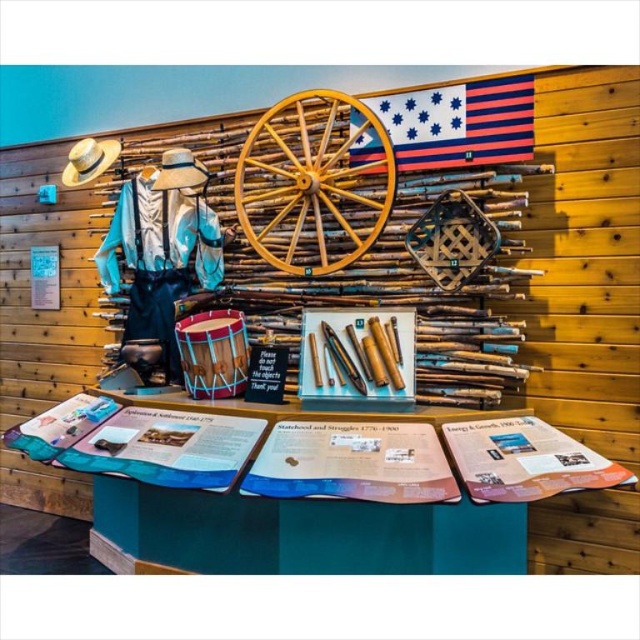
Which is above, blue denim jacket at left or striped fabric flag at upper center?

striped fabric flag at upper center is higher up.

This screenshot has width=640, height=640. What do you see at coordinates (161, 257) in the screenshot?
I see `blue denim jacket at left` at bounding box center [161, 257].

Does point (172, 182) lie behind point (403, 100)?

Yes, it is.

You are a GUI agent. You are given a task and a screenshot of the screen. Output one action in this format:
    pyautogui.click(x=<x>, y=<y>)
    Task: Click on the blue denim jacket at left
    This screenshot has height=640, width=640.
    Given the screenshot: What is the action you would take?
    pyautogui.click(x=161, y=257)

Does wooden wagon wheel at center appear on the left side of blue denim jacket at left?

No, wooden wagon wheel at center is not to the left of blue denim jacket at left.

You are a GUI agent. You are given a task and a screenshot of the screen. Output one action in this format:
    pyautogui.click(x=<x>, y=<y>)
    Task: Click on the wooden wagon wheel at center
    Image resolution: width=640 pixels, height=640 pixels.
    Given the screenshot: What is the action you would take?
    pyautogui.click(x=314, y=182)

This screenshot has height=640, width=640. In order to click on wooden wagon wheel at center in this screenshot , I will do `click(314, 182)`.

Does straw woven cowboy hat at upper left have a smaller size compared to light brown straw cowboy hat at upper left?

Indeed, straw woven cowboy hat at upper left has a smaller size compared to light brown straw cowboy hat at upper left.

Does point (106, 170) come closer to viewer compared to point (188, 152)?

No, (106, 170) is behind (188, 152).

Where is `straw woven cowboy hat at upper left`? The height and width of the screenshot is (640, 640). straw woven cowboy hat at upper left is located at coordinates (88, 161).